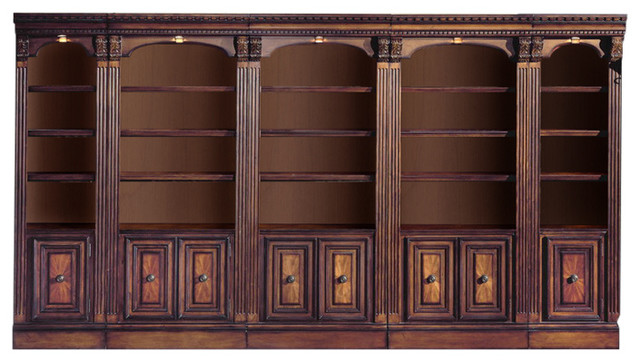
The height and width of the screenshot is (362, 640). What are the coordinates of `cabinet doors` in the screenshot? It's located at (56, 302), (157, 301), (198, 302), (294, 300), (345, 300), (436, 297), (491, 298), (573, 299).